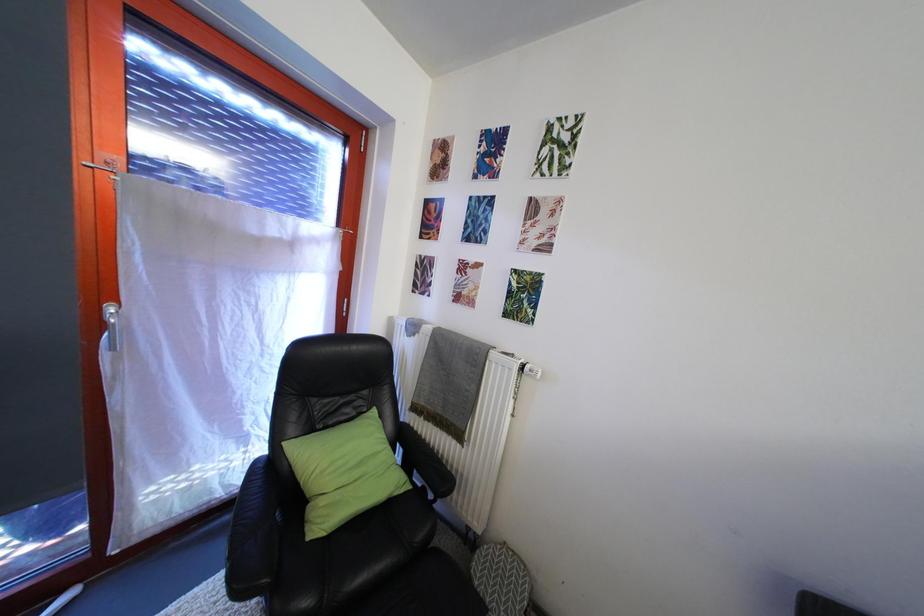
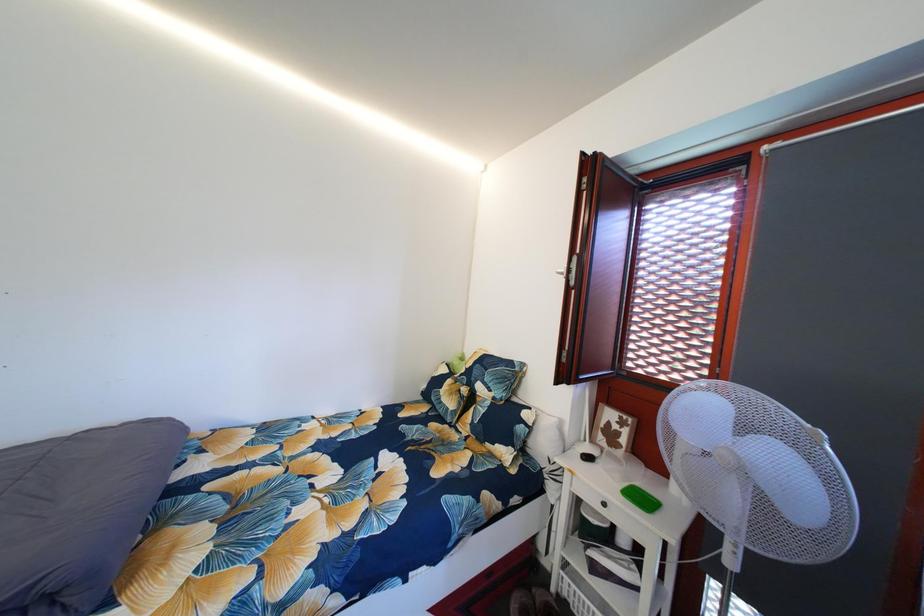
Question: The images are taken continuously from a first-person perspective. In which direction is your viewpoint rotating?

Choices:
 (A) Left
 (B) Right
 (C) Up
 (D) Down

Answer: (A)